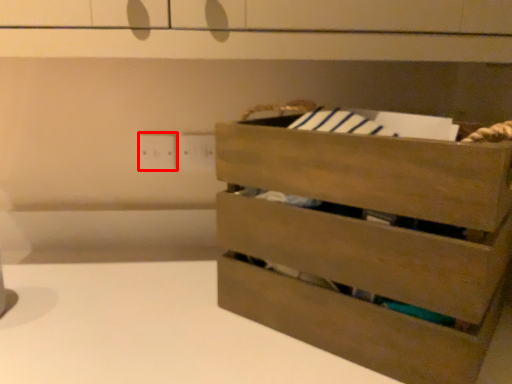
Question: Observing the image, what is the correct spatial positioning of electric outlet (annotated by the red box) in reference to chest of drawers?

Choices:
 (A) left
 (B) right

Answer: (A)